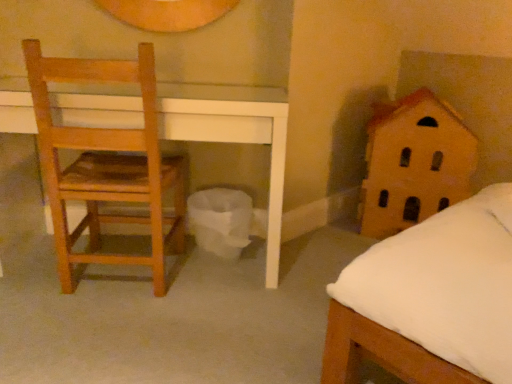
The height and width of the screenshot is (384, 512). I want to click on wooden house at right, so pos(414,163).

Describe the element at coordinates (414, 163) in the screenshot. I see `wooden house at right` at that location.

What do you see at coordinates (106, 164) in the screenshot? The width and height of the screenshot is (512, 384). I see `wooden chair at left` at bounding box center [106, 164].

At what (x,y) coordinates should I click in order to perform the action: click on wooden chair at left. Please return your answer as a coordinate pair (x, y). The width and height of the screenshot is (512, 384). Looking at the image, I should click on (106, 164).

Locate an element on the screen. wooden house at right is located at coordinates (414, 163).

Is wooden chair at left to the right of wooden house at right from the viewer's perspective?

No, wooden chair at left is not to the right of wooden house at right.

Considering their positions, is wooden chair at left located in front of or behind wooden house at right?

Clearly, wooden chair at left is in front of wooden house at right.

Does point (60, 254) come farther from viewer compared to point (430, 140)?

That is False.

From the image's perspective, would you say wooden chair at left is positioned over wooden house at right?

No, from the image's perspective, wooden chair at left is not above wooden house at right.

From a real-world perspective, which is physically above, wooden chair at left or wooden house at right?

In real-world perspective, wooden chair at left is above.

Based on the photo, between wooden chair at left and wooden house at right, which one has larger width?

wooden house at right.

Considering the relative sizes of wooden chair at left and wooden house at right in the image provided, is wooden chair at left taller than wooden house at right?

Correct, wooden chair at left is much taller as wooden house at right.

Between wooden chair at left and wooden house at right, which one has smaller size?

Smaller between the two is wooden chair at left.

Is wooden chair at left located outside wooden house at right?

Yes, wooden chair at left is outside of wooden house at right.

Based on the photo, is wooden chair at left beside wooden house at right?

No, wooden chair at left is not next to wooden house at right.

Is wooden house at right at the back of wooden chair at left?

wooden chair at left is not turned away from wooden house at right.

How many degrees apart are the facing directions of wooden chair at left and wooden house at right?

There is a 170-degree angle between the facing directions of wooden chair at left and wooden house at right.

Locate an element on the screen. toy above the wooden chair at left (from the image's perspective) is located at coordinates (414, 163).

Does wooden house at right appear on the left side of wooden chair at left?

Incorrect, wooden house at right is not on the left side of wooden chair at left.

Looking at this image, relative to wooden chair at left, is wooden house at right in front or behind?

wooden house at right is positioned farther from the viewer than wooden chair at left.

Which is in front, point (428, 203) or point (174, 225)?

The point (174, 225) is closer to the camera.

Based on the photo, from the image's perspective, which one is positioned lower, wooden house at right or wooden chair at left?

wooden chair at left appears lower in the image.

From a real-world perspective, does wooden house at right stand above wooden chair at left?

Incorrect, from a real-world perspective, wooden house at right is lower than wooden chair at left.

Considering the sizes of wooden house at right and wooden chair at left in the image, is wooden house at right wider or thinner than wooden chair at left?

Considering their sizes, wooden house at right looks broader than wooden chair at left.

Between wooden house at right and wooden chair at left, which one has more height?

wooden chair at left is taller.

Which of these two, wooden house at right or wooden chair at left, is smaller?

Smaller between the two is wooden chair at left.

Is wooden chair at left completely or partially inside wooden house at right?

No.

Are wooden house at right and wooden chair at left beside each other?

wooden house at right and wooden chair at left are not in contact.

Is wooden house at right oriented towards wooden chair at left?

No.

How different are the orientations of wooden house at right and wooden chair at left in degrees?

They differ by 170 degrees in their facing directions.

Locate an element on the screen. This screenshot has height=384, width=512. toy behind the wooden chair at left is located at coordinates (414, 163).

Locate an element on the screen. This screenshot has height=384, width=512. chair in front of the wooden house at right is located at coordinates (106, 164).

The height and width of the screenshot is (384, 512). Identify the location of toy above the wooden chair at left (from the image's perspective). (414, 163).